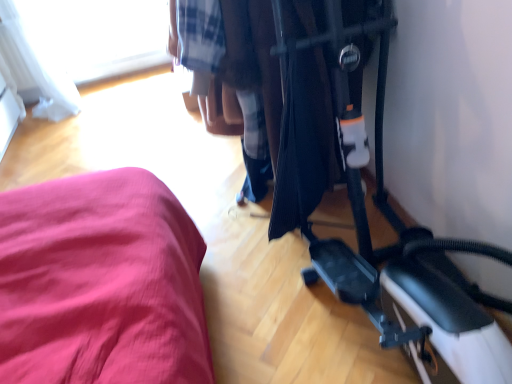
Question: Should I look upward or downward to see transparent glass window at upper left?

Choices:
 (A) down
 (B) up

Answer: (B)

Question: Is transparent glass window at upper left at the back of black plastic baby carriage at center?

Choices:
 (A) yes
 (B) no

Answer: (B)

Question: Can you confirm if black plastic baby carriage at center is taller than transparent glass window at upper left?

Choices:
 (A) no
 (B) yes

Answer: (B)

Question: Does black plastic baby carriage at center have a lesser width compared to transparent glass window at upper left?

Choices:
 (A) yes
 (B) no

Answer: (B)

Question: Is black plastic baby carriage at center bigger than transparent glass window at upper left?

Choices:
 (A) yes
 (B) no

Answer: (A)

Question: Is black plastic baby carriage at center further to the viewer compared to transparent glass window at upper left?

Choices:
 (A) yes
 (B) no

Answer: (B)

Question: From a real-world perspective, does black plastic baby carriage at center stand above transparent glass window at upper left?

Choices:
 (A) no
 (B) yes

Answer: (B)

Question: Does transparent glass window at upper left appear on the left side of black plastic baby carriage at center?

Choices:
 (A) no
 (B) yes

Answer: (B)

Question: Is transparent glass window at upper left far from black plastic baby carriage at center?

Choices:
 (A) yes
 (B) no

Answer: (A)

Question: Can you confirm if transparent glass window at upper left is taller than black plastic baby carriage at center?

Choices:
 (A) yes
 (B) no

Answer: (B)

Question: Is transparent glass window at upper left oriented towards black plastic baby carriage at center?

Choices:
 (A) no
 (B) yes

Answer: (B)

Question: From the image's perspective, is transparent glass window at upper left beneath black plastic baby carriage at center?

Choices:
 (A) no
 (B) yes

Answer: (A)

Question: Is transparent glass window at upper left positioned with its back to black plastic baby carriage at center?

Choices:
 (A) yes
 (B) no

Answer: (B)

Question: From their relative heights in the image, would you say transparent glass window at upper left is taller or shorter than black plastic baby carriage at center?

Choices:
 (A) tall
 (B) short

Answer: (B)